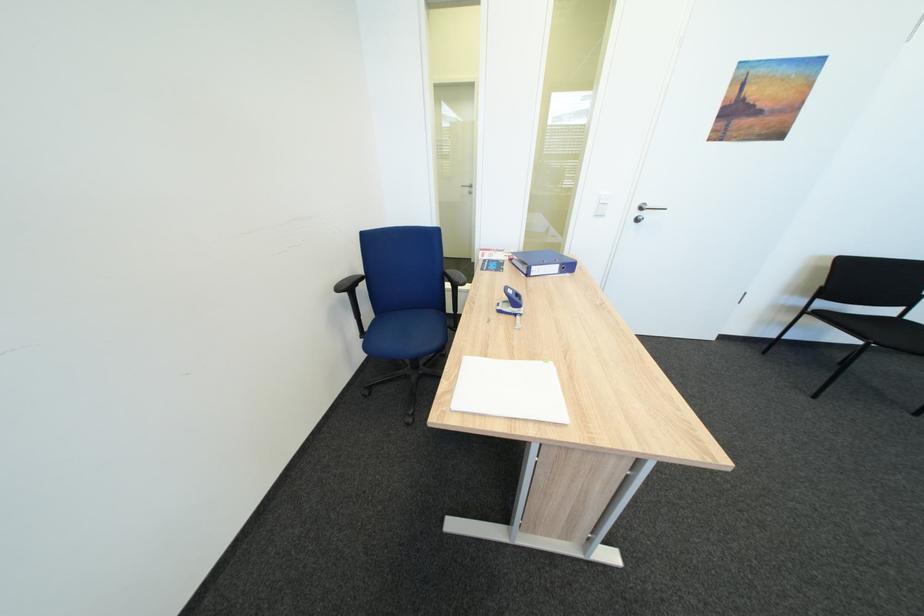
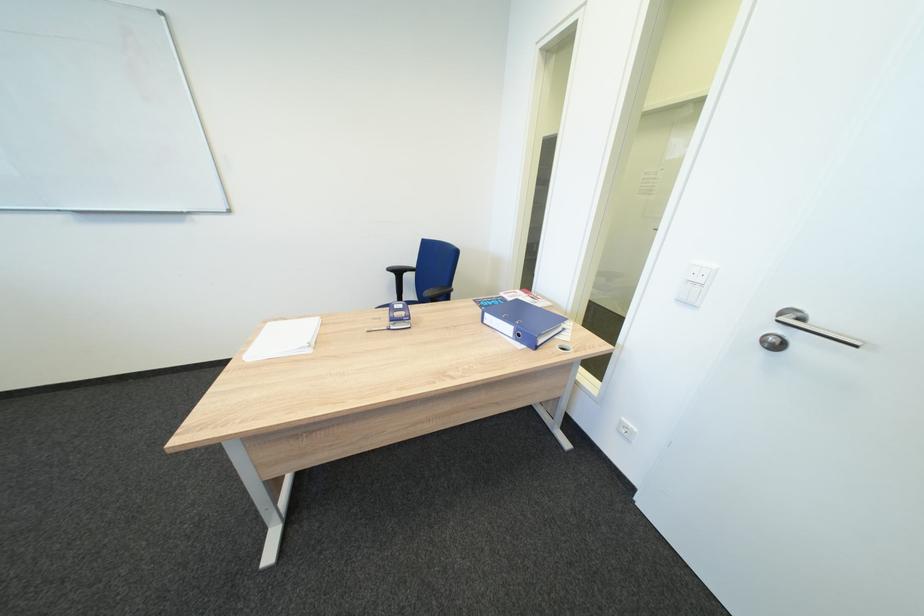
Locate, in the second image, the point that corresponds to pixel 348 291 in the first image.

(400, 270)